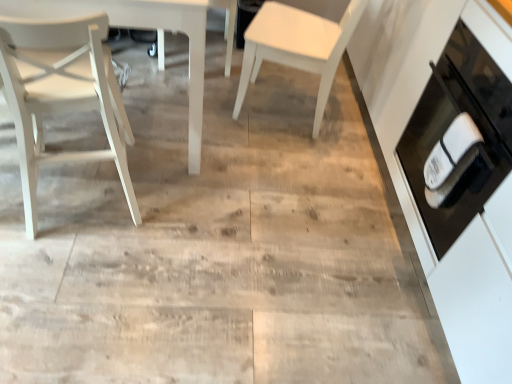
Question: In the image, is white matte chair at center, the 1th chair in the right-to-left sequence, positioned in front of or behind white matte chair at left, which ranks as the 3th chair in right-to-left order?

Choices:
 (A) front
 (B) behind

Answer: (B)

Question: From the image's perspective, is white matte chair at center, the third chair when ordered from left to right, positioned above or below white matte chair at left, which ranks as the first chair in left-to-right order?

Choices:
 (A) below
 (B) above

Answer: (B)

Question: Considering the real-world distances, which object is closest to the white matte chair at center, the third chair when ordered from left to right?

Choices:
 (A) black glass oven at right
 (B) white matte chair at center, arranged as the second chair when viewed from the right
 (C) white matte chair at left, which ranks as the first chair in left-to-right order

Answer: (B)

Question: Which is farther from the black glass oven at right?

Choices:
 (A) white matte chair at center, the 1th chair in the right-to-left sequence
 (B) white matte chair at left, which ranks as the 3th chair in right-to-left order
 (C) white matte chair at center, the second chair in the left-to-right sequence

Answer: (C)